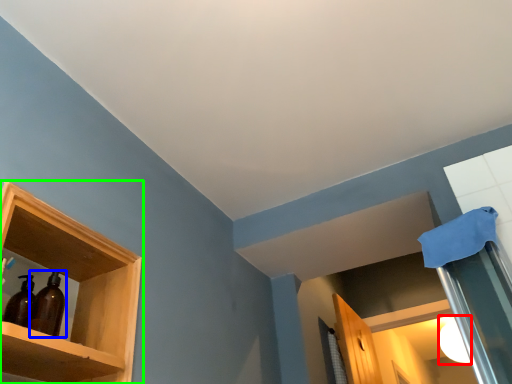
Question: Which object is positioned farthest from lighting (highlighted by a red box)? Select from bottle (highlighted by a blue box) and shelf (highlighted by a green box).

Choices:
 (A) bottle
 (B) shelf

Answer: (A)